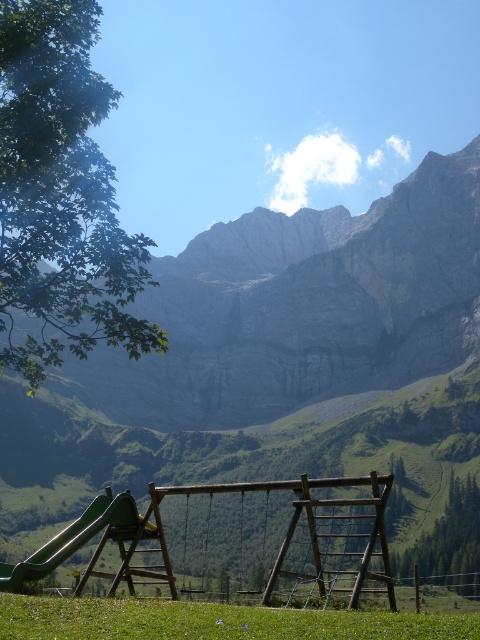
You are a parent trying to decide where to let your child play. You see the green grassy field at lower center and the green plastic slide at lower left. Which area has more space for running around?

The green plastic slide at lower left is larger than the green grassy field at lower center, so there is more space for running around near the green plastic slide at lower left.

You are standing at the playground set in the image. There is a point marked at coordinates point (213, 620). Based on the scene description, where is this point located?

The point (213, 620) is located on the green grassy field at lower center.

You are standing at the playground and want to take a photo of the gray rock mountain at upper center. If your camera can focus on objects up to 200 meters away, will it be able to capture a clear image of the mountain?

The gray rock mountain at upper center is 157.71 meters away from the camera. Since this distance is within the camera maximum focus range of 200 meters, the camera can capture a clear image of the mountain.